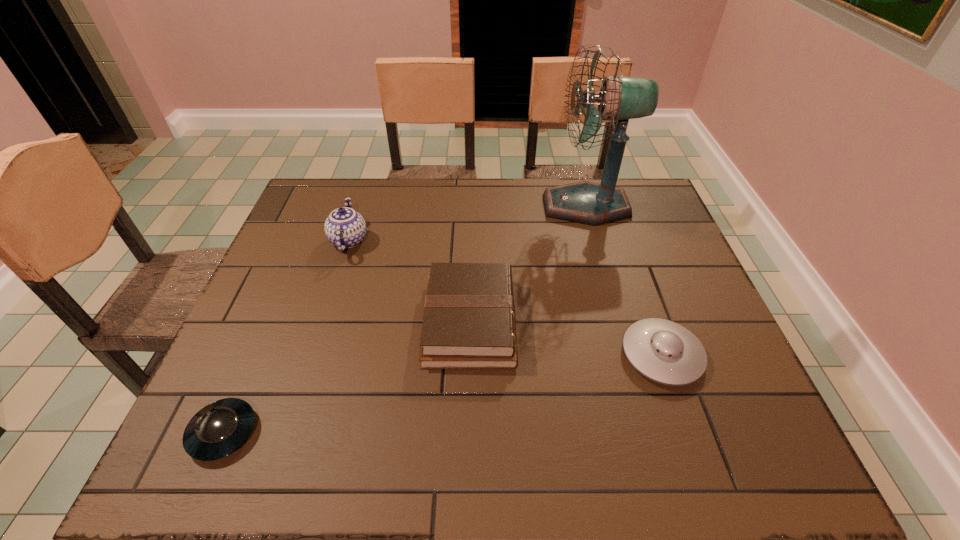
Identify the location of saucer situated at the left edge. The height and width of the screenshot is (540, 960). (220, 428).

The height and width of the screenshot is (540, 960). I want to click on fan that is at the right edge, so click(620, 98).

Image resolution: width=960 pixels, height=540 pixels. I want to click on saucer that is at the right edge, so click(663, 351).

The height and width of the screenshot is (540, 960). What are the coordinates of `object at the far left corner` in the screenshot? It's located at (345, 228).

This screenshot has width=960, height=540. Identify the location of object that is at the near left corner. (220, 428).

What are the coordinates of `object that is at the far right corner` in the screenshot? It's located at (620, 98).

At what (x,y) coordinates should I click in order to perform the action: click on vacant area at the far edge of the desktop. Please return your answer as a coordinate pair (x, y). Looking at the image, I should click on pos(421,202).

Locate an element on the screen. free space at the near edge is located at coordinates (492, 461).

I want to click on free region at the left edge of the desktop, so click(337, 248).

I want to click on vacant space at the right edge of the desktop, so click(x=698, y=286).